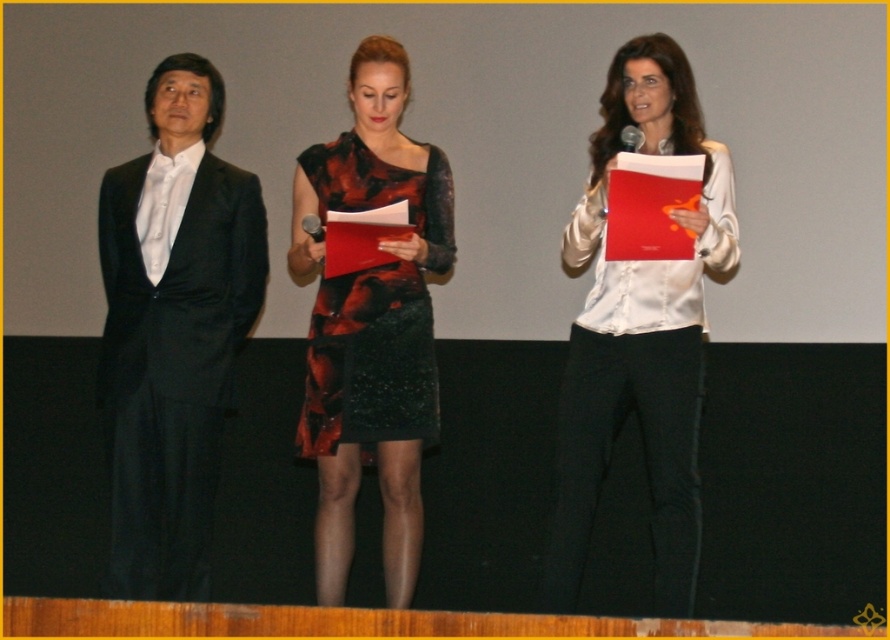
Is point (670, 84) more distant than point (382, 164)?

No, (670, 84) is in front of (382, 164).

Is white satin blouse at center below black textured dress at center?

Actually, white satin blouse at center is above black textured dress at center.

Which is behind, point (630, 266) or point (386, 440)?

Positioned behind is point (386, 440).

Locate an element on the screen. This screenshot has height=640, width=890. white satin blouse at center is located at coordinates (638, 333).

Between white satin blouse at center and matte black suit at left, which one appears on the left side from the viewer's perspective?

From the viewer's perspective, matte black suit at left appears more on the left side.

Based on the photo, is white satin blouse at center taller than matte black suit at left?

Yes, white satin blouse at center is taller than matte black suit at left.

Is point (646, 106) less distant than point (102, 388)?

Yes, it is.

Identify the location of white satin blouse at center. The image size is (890, 640). (638, 333).

Does black textured dress at center have a greater height compared to matte black suit at left?

Correct, black textured dress at center is much taller as matte black suit at left.

Which is in front, point (345, 579) or point (180, 596)?

Point (180, 596) is in front.

Is point (363, 106) positioned in front of point (166, 292)?

That is False.

Where is `black textured dress at center`? The image size is (890, 640). black textured dress at center is located at coordinates tap(371, 324).